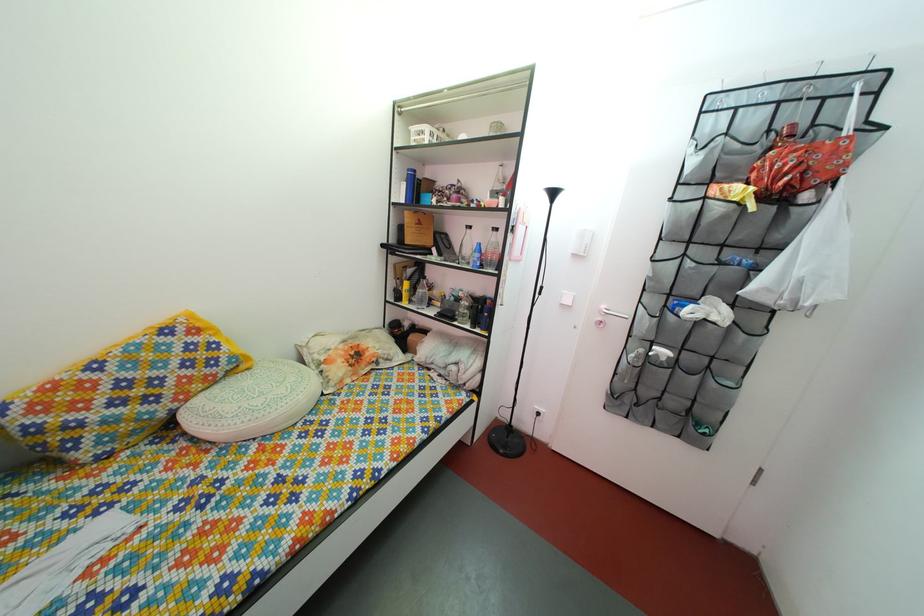
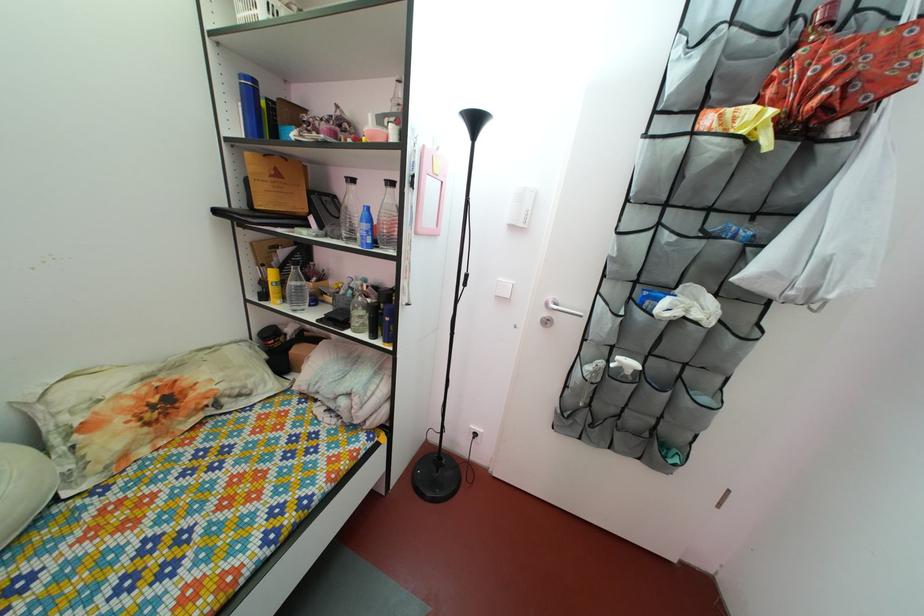
In the second image, find the point that corresponds to the point at 419,280 in the first image.

(292, 262)